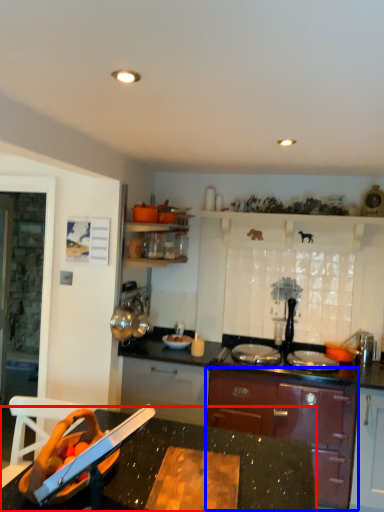
Question: Which point is closer to the camera, countertop (highlighted by a red box) or cabinetry (highlighted by a blue box)?

Choices:
 (A) countertop
 (B) cabinetry

Answer: (A)